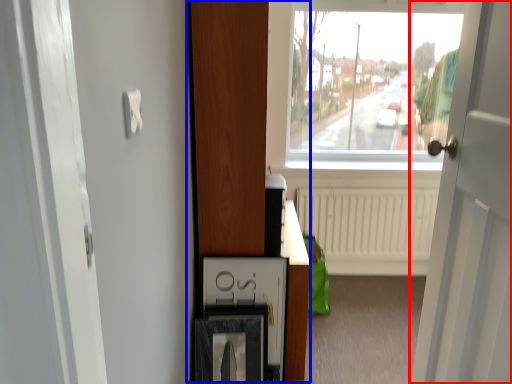
Question: Which object is further to the camera taking this photo, door (highlighted by a red box) or dresser (highlighted by a blue box)?

Choices:
 (A) door
 (B) dresser

Answer: (B)